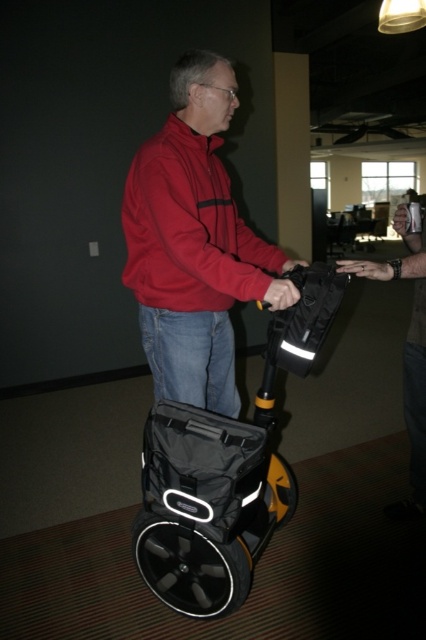
You are standing in a hallway and see the black matte scooter at center. If you want to reach the scooter without moving your feet, can you touch it with your outstretched hand?

The black matte scooter at center is 1.49 meters away from the viewer. Since the average human arm length is about 0.7 meters, you cannot reach it without moving closer.

You are a delivery person who needs to ensure that the distance between your jacket and the scooter is within safety guidelines. According to regulations, the jacket must be kept at least 12 inches away from the scooter to avoid overheating. Is the current distance between the matte red jacket at center and the black matte scooter at center compliant with this requirement?

The distance between the matte red jacket at center and the black matte scooter at center is 13.80 inches, which exceeds the minimum required 12 inches. Therefore, the current distance complies with the safety guidelines.

Consider the image. The man in the image is wearing a matte red jacket at center and a denim jacket at center. Which jacket is visible on top?

The matte red jacket at center is positioned over denim jacket at center, so the matte red jacket at center is visible on top.